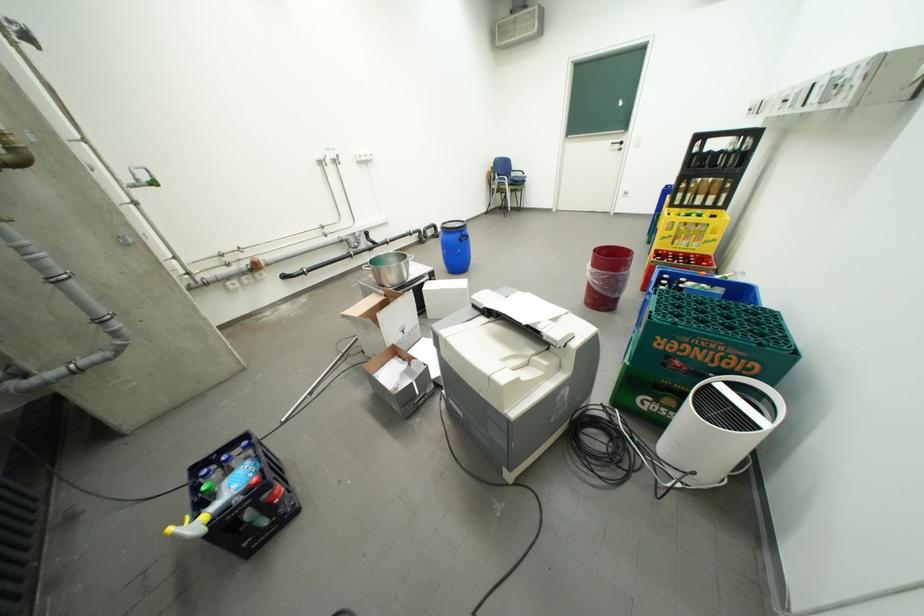
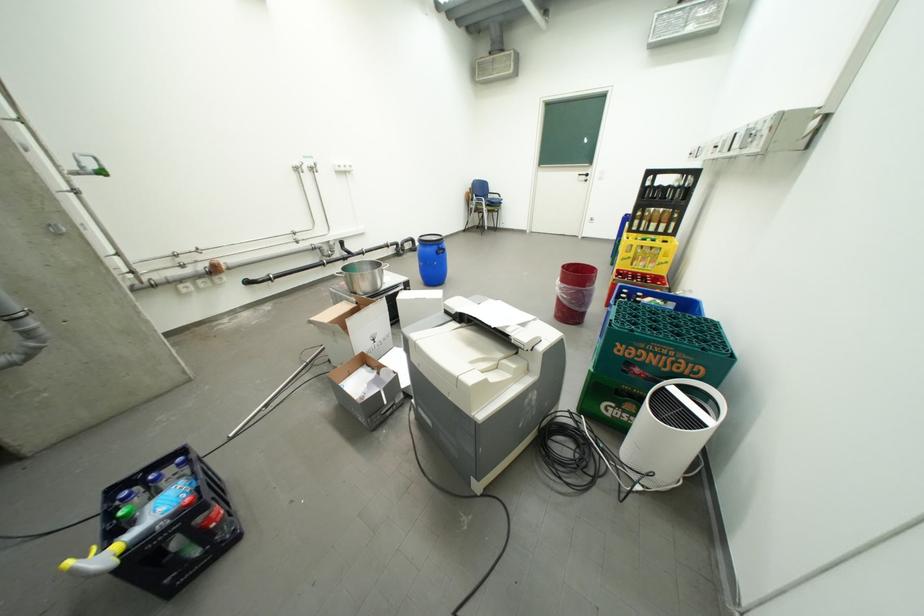
Question: Based on the continuous images, in which direction is the camera rotating? Reply with the corresponding letter.

Choices:
 (A) Left
 (B) Right
 (C) Up
 (D) Down

Answer: (B)